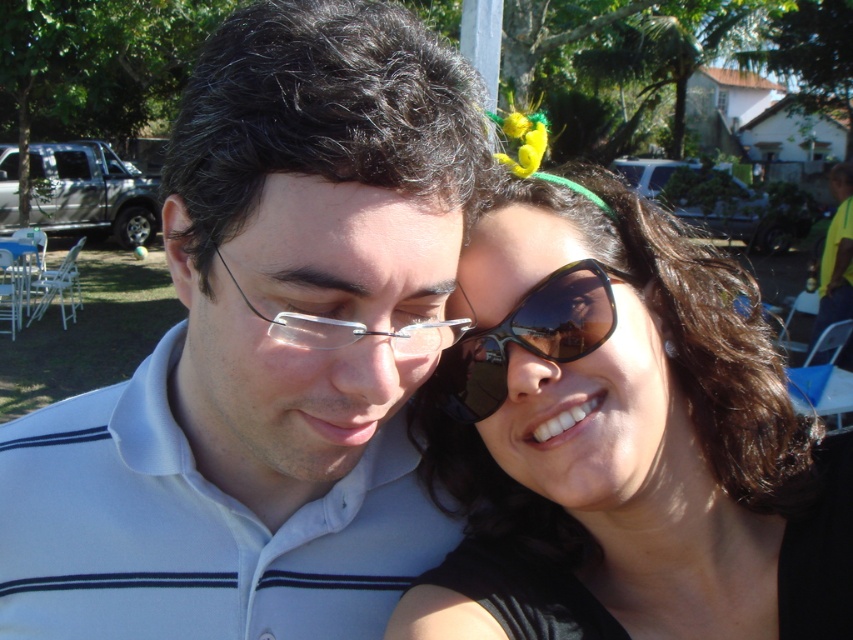
Which is in front, point (399, 328) or point (535, 298)?

Point (399, 328)

Which is in front, point (279, 220) or point (492, 524)?

Positioned in front is point (279, 220).

I want to click on white matte shirt at center, so click(265, 353).

Is white matte shirt at center positioned behind black reflective sunglasses at center?

That is False.

Who is more distant from viewer, (154, 625) or (479, 408)?

The point (154, 625) is behind.

The width and height of the screenshot is (853, 640). Find the location of `white matte shirt at center`. white matte shirt at center is located at coordinates (265, 353).

Between sunglasses at upper right and clear plastic glasses at center, which one has more height?

With more height is sunglasses at upper right.

Measure the distance from sunglasses at upper right to clear plastic glasses at center.

sunglasses at upper right and clear plastic glasses at center are 7.33 inches apart from each other.

Who is more forward, (693, 321) or (328, 330)?

Point (328, 330) is in front.

In order to click on sunglasses at upper right in this screenshot , I will do `click(622, 440)`.